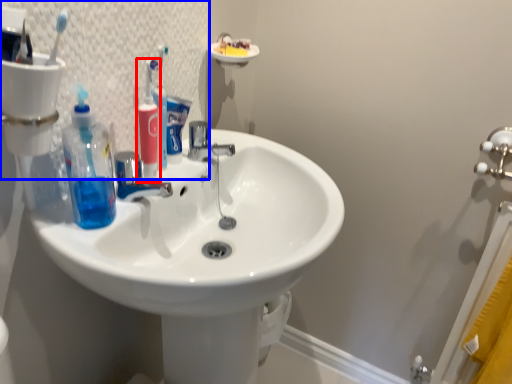
Question: Which object is further to the camera taking this photo, toiletry (highlighted by a red box) or mirror (highlighted by a blue box)?

Choices:
 (A) toiletry
 (B) mirror

Answer: (A)